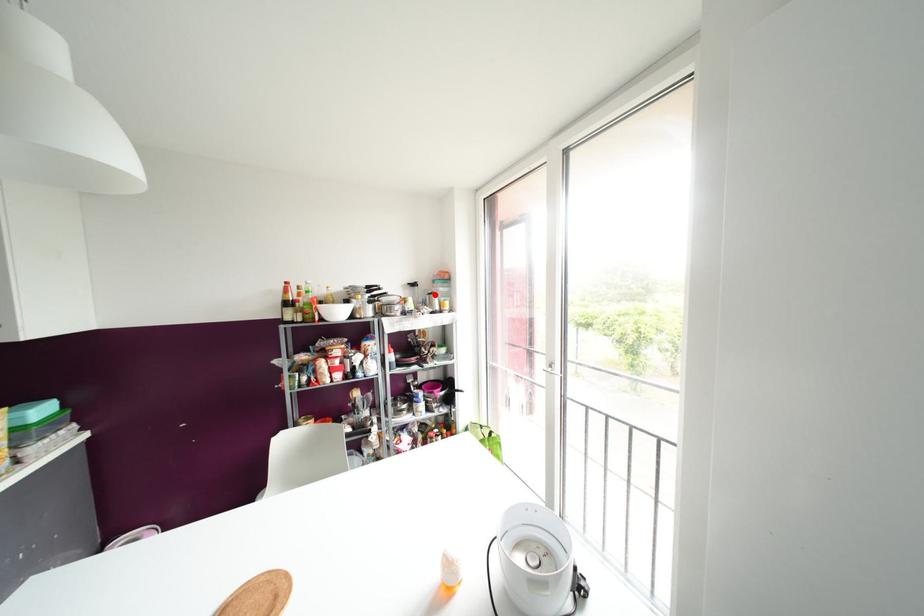
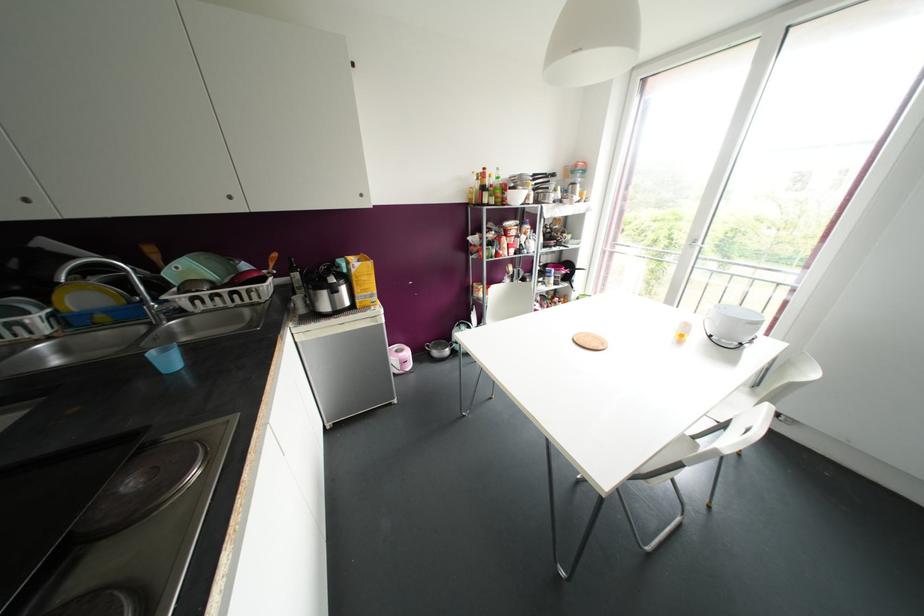
Where in the second image is the point corresponding to the highlighted location from the first image?

(578, 185)